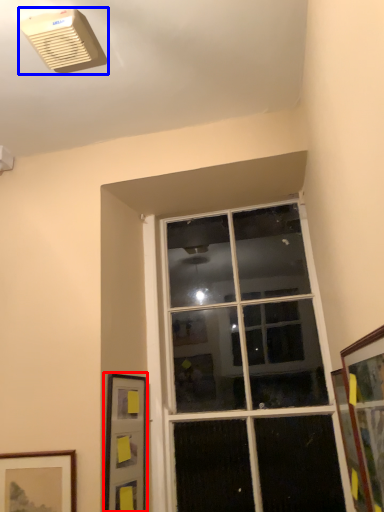
Question: Which object appears farthest to the camera in this image, picture frame (highlighted by a red box) or air conditioning (highlighted by a blue box)?

Choices:
 (A) picture frame
 (B) air conditioning

Answer: (A)